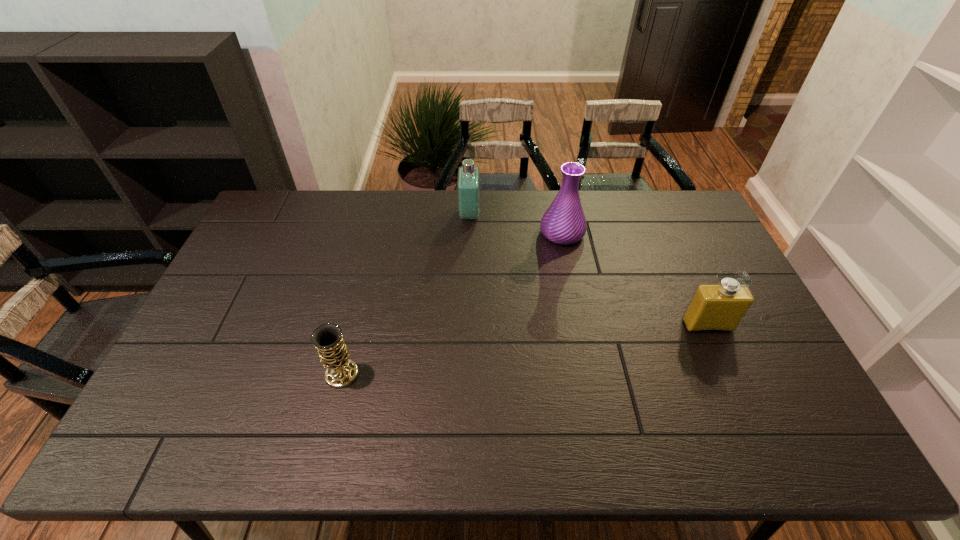
Identify the location of empty space that is in between the nearer perfume and the tallest object. (635, 279).

Identify the location of vacant area between the right perfume and the nearest object. (525, 350).

This screenshot has height=540, width=960. In order to click on free space that is in between the rightmost object and the nearest object in this screenshot , I will do (525, 350).

Identify the location of free space between the nearest object and the third farthest object. (525, 350).

Image resolution: width=960 pixels, height=540 pixels. In order to click on free spot between the third object from right to left and the shortest object in this screenshot , I will do `click(406, 294)`.

Where is `vacant area that lies between the right perfume and the chalice`? vacant area that lies between the right perfume and the chalice is located at coordinates (525, 350).

Where is `vacant space that's between the rightmost object and the shortest object`? The image size is (960, 540). vacant space that's between the rightmost object and the shortest object is located at coordinates (525, 350).

At what (x,y) coordinates should I click in order to perform the action: click on unoccupied area between the chalice and the third object from left to right. Please return your answer as a coordinate pair (x, y). The image size is (960, 540). Looking at the image, I should click on (452, 303).

Where is `free space between the third object from left to right and the nearer perfume`? This screenshot has width=960, height=540. free space between the third object from left to right and the nearer perfume is located at coordinates (635, 279).

Locate an element on the screen. object that stands as the second closest to the second object from left to right is located at coordinates (328, 340).